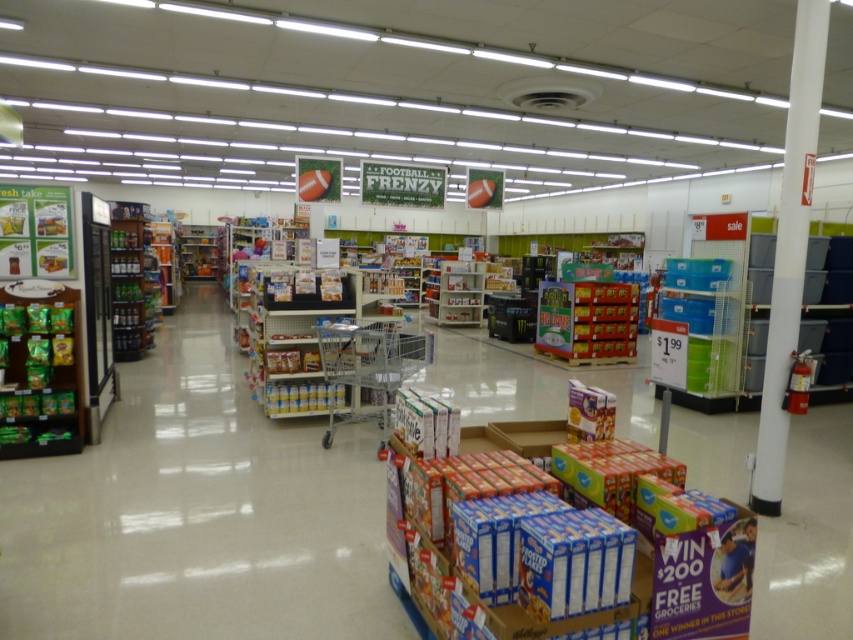
This screenshot has width=853, height=640. Identify the location of green matte snack at left. pyautogui.click(x=39, y=369).

I want to click on metallic silver shopping cart at center, so click(369, 364).

Between point (329, 358) and point (123, 353), which one is positioned in front?

Point (329, 358) is in front.

Where is `metallic silver shopping cart at center`? Image resolution: width=853 pixels, height=640 pixels. metallic silver shopping cart at center is located at coordinates (369, 364).

What do you see at coordinates (585, 321) in the screenshot? I see `matte cardboard cereal boxes at center` at bounding box center [585, 321].

The height and width of the screenshot is (640, 853). Find the location of `matte cardboard cereal boxes at center`. matte cardboard cereal boxes at center is located at coordinates (585, 321).